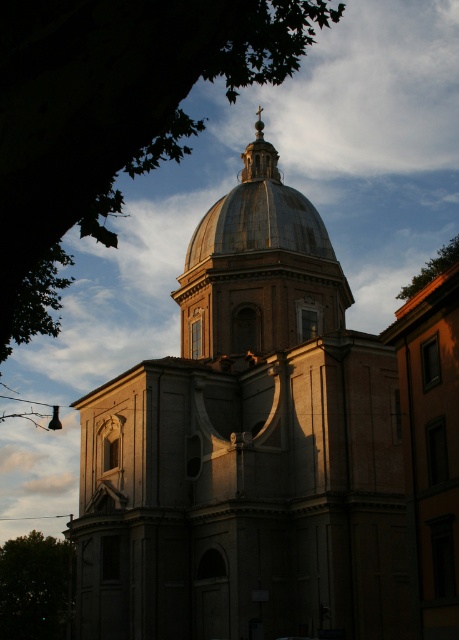
You are standing in front of the classical church structure. You notice two points marked on the building. One is at coordinate point (51, 19) and the other at point (403, 288). Which of these two points is closer to your current position?

Point (51, 19) is in front of point (403, 288), so it is closer to your current position.

You are standing in front of the classical church structure. You notice two green leafy trees in the image. Which tree, the green leafy tree at lower left or the green leafy tree at upper right, has a larger width?

The green leafy tree at upper right has a larger width because the green leafy tree at lower left is thinner than it.